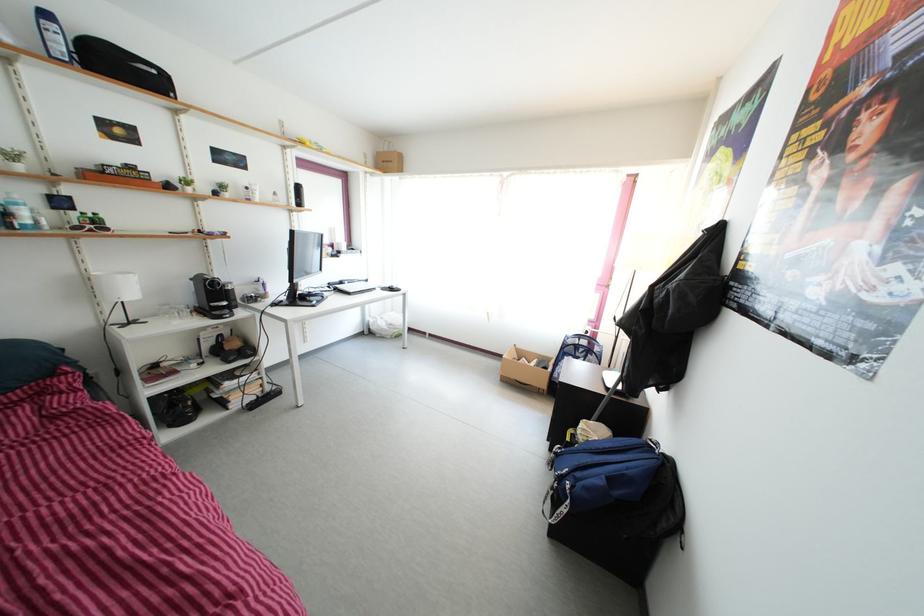
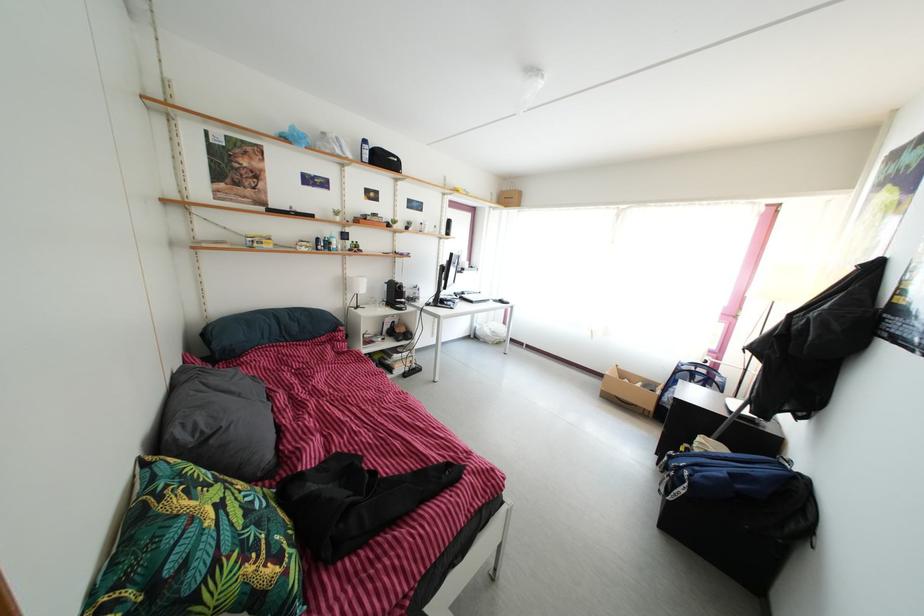
Find the pixel in the second image that matches (x=543, y=373) in the first image.

(650, 394)